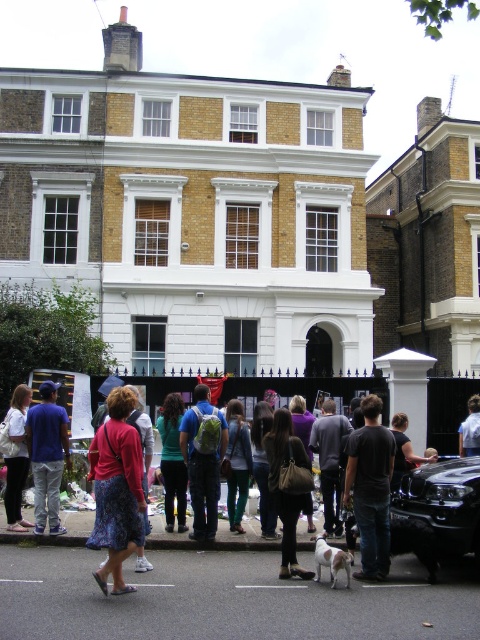
Question: Can you confirm if denim jacket at lower left is positioned to the right of white cotton shirt at center?

Choices:
 (A) no
 (B) yes

Answer: (A)

Question: Estimate the real-world distances between objects in this image. Which object is farther from the white cotton shirt at center?

Choices:
 (A) black cotton shirt at center
 (B) floral skirt at center
 (C) matte blue jeans at left
 (D) denim jacket at lower left

Answer: (B)

Question: Estimate the real-world distances between objects in this image. Which object is closer to the white cotton shirt at center?

Choices:
 (A) matte green backpack at center
 (B) denim jacket at lower left
 (C) matte blue jeans at left
 (D) floral skirt at center

Answer: (A)

Question: Can you confirm if black glossy car at lower right is positioned below denim jacket at lower left?

Choices:
 (A) yes
 (B) no

Answer: (B)

Question: Which is nearer to the black glossy car at lower right?

Choices:
 (A) white cotton shirt at center
 (B) denim jacket at lower left
 (C) matte blue jeans at left
 (D) floral skirt at center

Answer: (D)

Question: Is matte green backpack at center thinner than denim jacket at lower left?

Choices:
 (A) yes
 (B) no

Answer: (B)